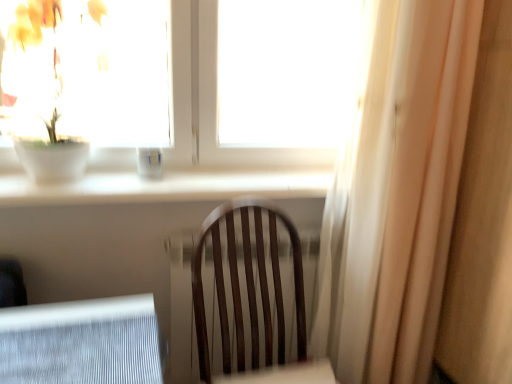
Question: Can you confirm if green matte plant at upper left is smaller than transparent glass window at upper center?

Choices:
 (A) yes
 (B) no

Answer: (A)

Question: From a real-world perspective, is green matte plant at upper left physically above transparent glass window at upper center?

Choices:
 (A) no
 (B) yes

Answer: (A)

Question: Considering the relative sizes of green matte plant at upper left and transparent glass window at upper center in the image provided, is green matte plant at upper left shorter than transparent glass window at upper center?

Choices:
 (A) no
 (B) yes

Answer: (B)

Question: Does green matte plant at upper left have a larger size compared to transparent glass window at upper center?

Choices:
 (A) no
 (B) yes

Answer: (A)

Question: Is green matte plant at upper left behind transparent glass window at upper center?

Choices:
 (A) no
 (B) yes

Answer: (A)

Question: Is green matte plant at upper left positioned far away from transparent glass window at upper center?

Choices:
 (A) no
 (B) yes

Answer: (A)

Question: From the image's perspective, is transparent glass window at upper center located beneath white sheer curtain at right?

Choices:
 (A) yes
 (B) no

Answer: (B)

Question: Can you confirm if transparent glass window at upper center is thinner than white sheer curtain at right?

Choices:
 (A) yes
 (B) no

Answer: (A)

Question: Is transparent glass window at upper center bigger than white sheer curtain at right?

Choices:
 (A) yes
 (B) no

Answer: (B)

Question: Does transparent glass window at upper center have a greater height compared to white sheer curtain at right?

Choices:
 (A) no
 (B) yes

Answer: (A)

Question: Is white sheer curtain at right a part of transparent glass window at upper center?

Choices:
 (A) yes
 (B) no

Answer: (B)

Question: Could you tell me if transparent glass window at upper center is facing white sheer curtain at right?

Choices:
 (A) yes
 (B) no

Answer: (B)

Question: Does white sheer curtain at right have a larger size compared to green matte plant at upper left?

Choices:
 (A) yes
 (B) no

Answer: (A)